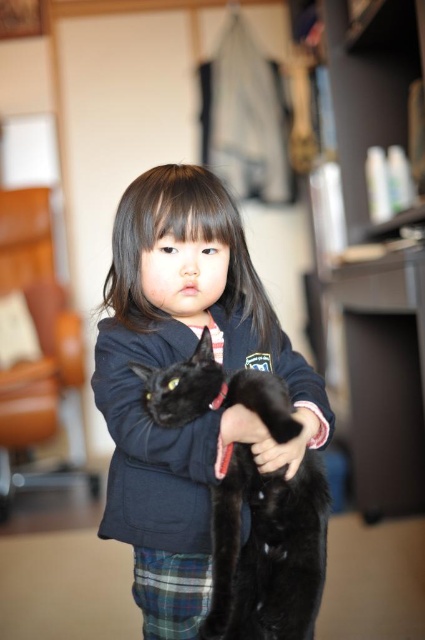
What are the coordinates of the shiny black cat at center?

The shiny black cat at center is located at point (268, 552).

You are a photographer trying to capture a clear shot of the shiny black cat at center and the plaid fabric kilt at lower center. Based on their positions, which object should you focus on first to ensure both are in focus?

The shiny black cat at center is in front of the plaid fabric kilt at lower center, so you should focus on the shiny black cat at center first to ensure both are in focus.